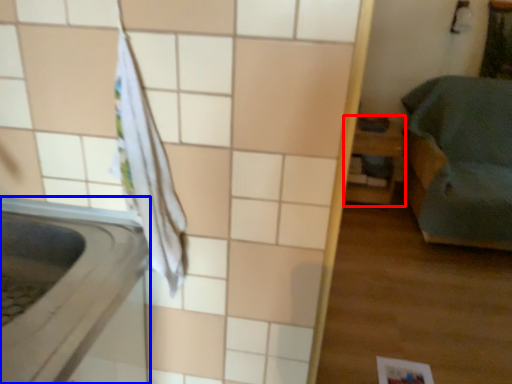
Question: Which object is further to the camera taking this photo, furniture (highlighted by a red box) or appliance (highlighted by a blue box)?

Choices:
 (A) furniture
 (B) appliance

Answer: (A)